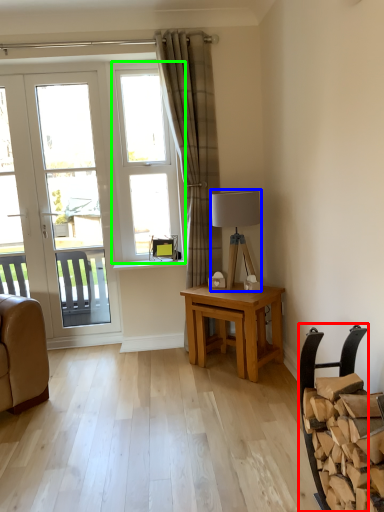
Question: Based on their relative distances, which object is farther from chair (highlighted by a red box)? Choose from lamp (highlighted by a blue box) and window (highlighted by a green box).

Choices:
 (A) lamp
 (B) window

Answer: (B)